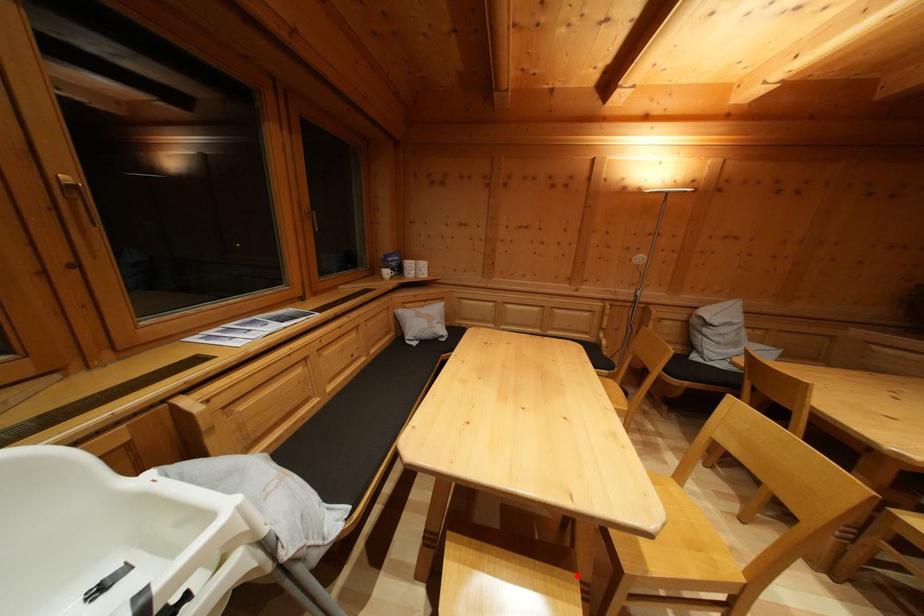
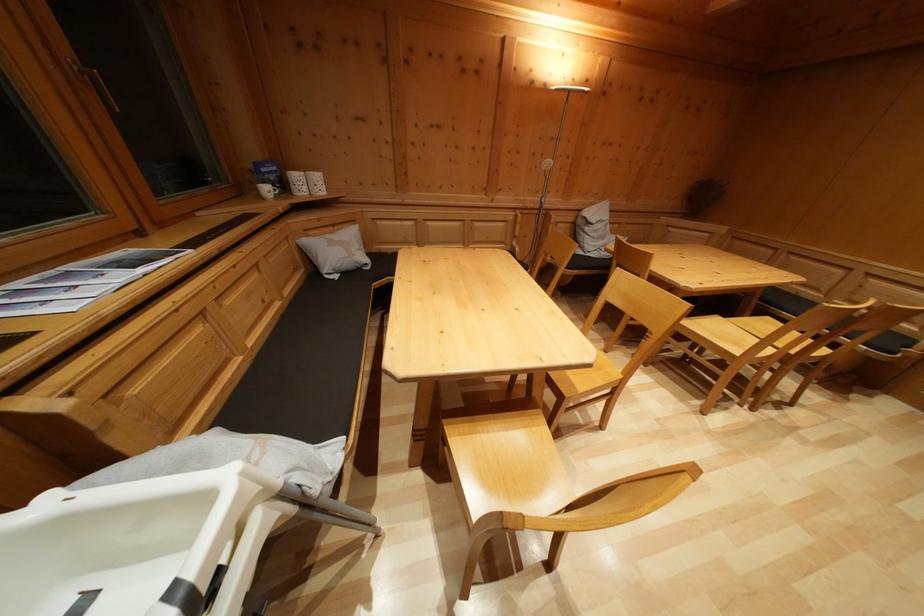
The point at the highlighted location is marked in the first image. Where is the corresponding point in the second image?

(541, 415)